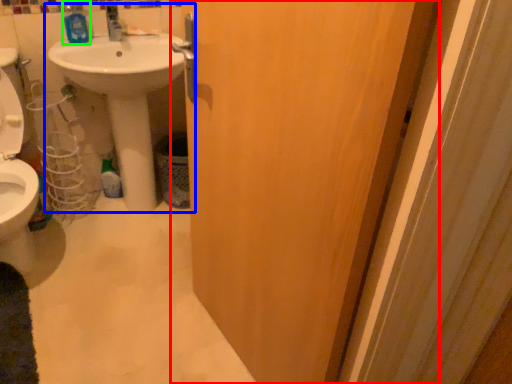
Question: Which is farther away from door (highlighted by a red box)? sink (highlighted by a blue box) or mouthwash (highlighted by a green box)?

Choices:
 (A) sink
 (B) mouthwash

Answer: (B)